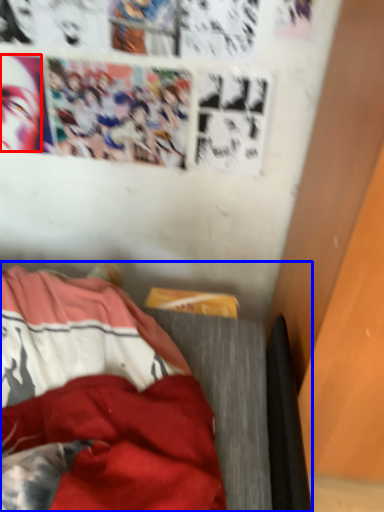
Question: Which point is further to the camera, human face (highlighted by a red box) or furniture (highlighted by a blue box)?

Choices:
 (A) human face
 (B) furniture

Answer: (A)